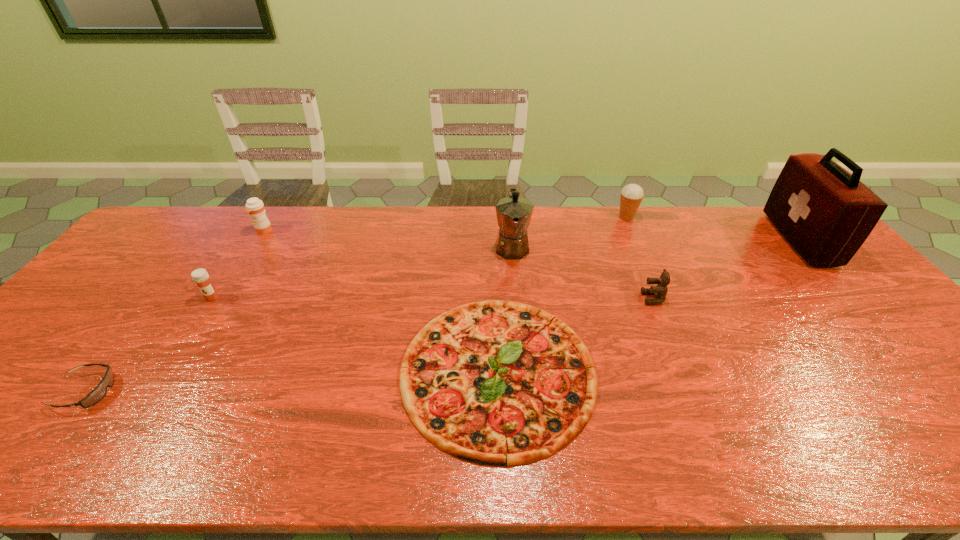
The image size is (960, 540). What are the coordinates of `blank area located 0.110m on the side of the first aid kit with the cross symbol` in the screenshot? It's located at (747, 239).

In order to click on vacant space located 0.340m on the side of the first aid kit with the cross symbol in this screenshot , I will do `click(677, 239)`.

Locate an element on the screen. free spot located on the side of the first aid kit with the cross symbol is located at coordinates [x=695, y=239].

Locate an element on the screen. vacant area located on the pouring side of the coffeepot is located at coordinates (519, 335).

Find the location of a particular element. This screenshot has width=960, height=540. vacant space situated on the right of the icecream is located at coordinates pyautogui.click(x=674, y=218).

Locate an element on the screen. blank space located on the right of the farther medicine is located at coordinates (370, 231).

Where is `free space located 0.360m on the label side of the shorter medicine`? free space located 0.360m on the label side of the shorter medicine is located at coordinates (134, 420).

You are a GUI agent. You are given a task and a screenshot of the screen. Output one action in this format:
    pyautogui.click(x=<x>, y=<y>)
    Task: Click on the free spot located on the face of the teddy bear
    The width and height of the screenshot is (960, 540).
    Given the screenshot: What is the action you would take?
    pyautogui.click(x=575, y=299)

At what (x,y) coordinates should I click in order to perform the action: click on free space located on the face of the teddy bear. Please return your answer as a coordinate pair (x, y). The height and width of the screenshot is (540, 960). Looking at the image, I should click on (621, 299).

Where is `vacant space situated on the face of the teddy bear`? vacant space situated on the face of the teddy bear is located at coordinates (564, 299).